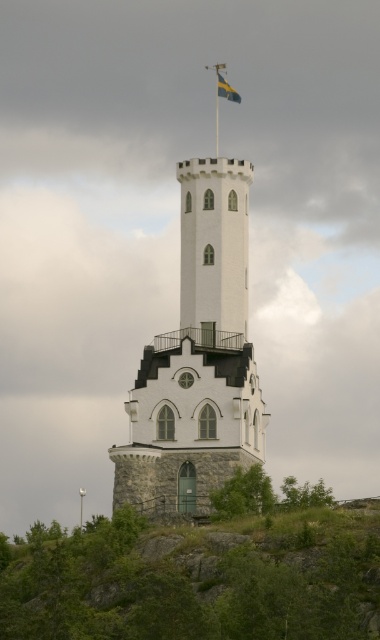
You are standing in front of the tower and want to place a small flag on the closest object to you between the green grassy hillside at lower center and the blue and yellow striped fabric at top center. Which object should you choose?

The green grassy hillside at lower center is closer to the viewer than the blue and yellow striped fabric at top center, so you should place the flag on the green grassy hillside at lower center.

You are a tourist visiting the tower and notice the blue and yellow striped fabric at top center and the metallic flag pole at top. Which object is positioned higher up in the tower?

The blue and yellow striped fabric at top center is positioned higher up than the metallic flag pole at top.

You are standing at the base of the tower and want to place a 100 meter long decorative banner between the green grassy hillside at lower center and the metallic flag pole at top. Can the banner stretch from one to the other without needing to be cut?

The distance between the green grassy hillside at lower center and the metallic flag pole at top is 75.48 meters. Since the banner is 100 meters long, it can easily stretch between them without needing to be cut, as the banner is longer than the distance required.